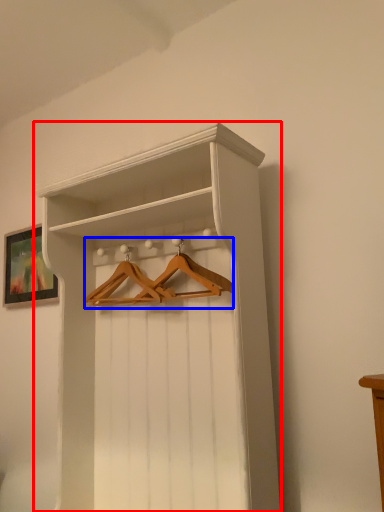
Question: Which object is further to the camera taking this photo, shelf (highlighted by a red box) or hanger (highlighted by a blue box)?

Choices:
 (A) shelf
 (B) hanger

Answer: (B)